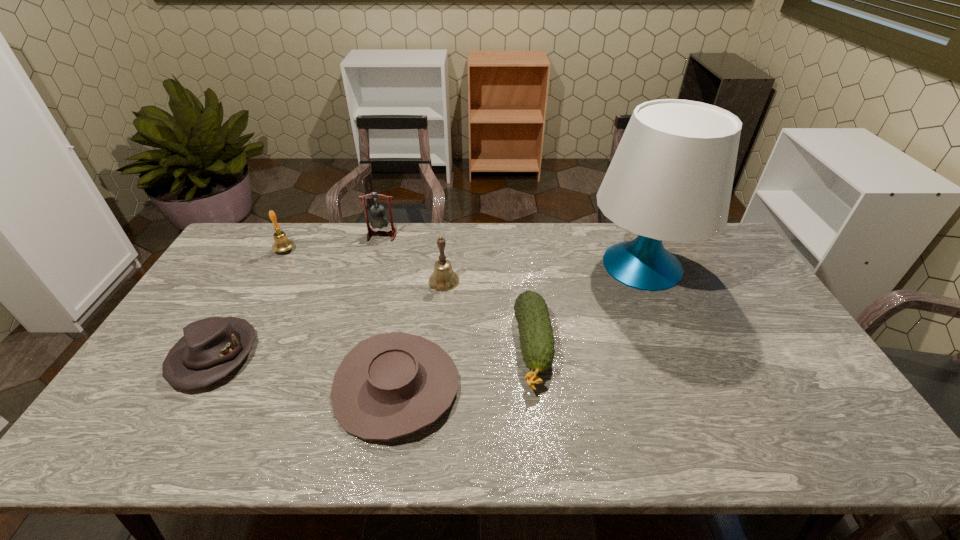
The width and height of the screenshot is (960, 540). Find the location of `hat that is positioned at the left edge`. hat that is positioned at the left edge is located at coordinates (211, 348).

What are the coordinates of `object that is at the right edge` in the screenshot? It's located at (671, 177).

Locate an element on the screen. This screenshot has height=540, width=960. object that is positioned at the far left corner is located at coordinates [281, 243].

Locate an element on the screen. The image size is (960, 540). object that is at the far right corner is located at coordinates (671, 177).

The image size is (960, 540). Find the location of `vacant region at the far edge`. vacant region at the far edge is located at coordinates (570, 224).

At what (x,y) coordinates should I click in order to perform the action: click on vacant space at the near edge of the desktop. Please return your answer as a coordinate pair (x, y). This screenshot has height=540, width=960. Looking at the image, I should click on (617, 435).

The image size is (960, 540). Find the location of `vacant space at the left edge`. vacant space at the left edge is located at coordinates (250, 289).

The width and height of the screenshot is (960, 540). In order to click on blank space at the right edge of the desktop in this screenshot , I will do `click(774, 355)`.

Locate an element on the screen. The image size is (960, 540). free space between the rightmost bell and the hat is located at coordinates (329, 318).

Identify the location of free area in between the leftmost bell and the cowboy hat. (341, 319).